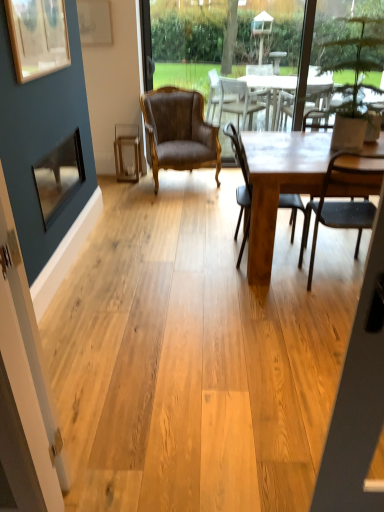
Question: Which is correct: wooden table at center is inside brown leather chair at center, or outside of it?

Choices:
 (A) inside
 (B) outside

Answer: (B)

Question: From a real-world perspective, relative to brown leather chair at center, is wooden table at center vertically above or below?

Choices:
 (A) above
 (B) below

Answer: (B)

Question: Estimate the real-world distances between objects in this image. Which object is closer to the brown leather chair at center?

Choices:
 (A) metallic glass picture frame at left, which is the 2th picture frame in front-to-back order
 (B) brown leather armchair at center, acting as the first chair starting from the back
 (C) matte gold picture frame at upper left, the first picture frame when ordered from top to bottom
 (D) matte brown chair at center, the second chair in the back-to-front sequence
 (E) matte brown chair at center, the first chair in the front-to-back sequence

Answer: (B)

Question: Which object is the farthest from the wooden picture frame at upper left, which appears as the 1th picture frame when viewed from the front?

Choices:
 (A) brown leather armchair at center, acting as the first chair starting from the back
 (B) matte brown chair at center, the 1th chair when ordered from right to left
 (C) matte brown chair at center, placed as the 2th chair when sorted from front to back
 (D) matte gold picture frame at upper left, the 3th picture frame ordered from the bottom
 (E) wooden table at center

Answer: (B)